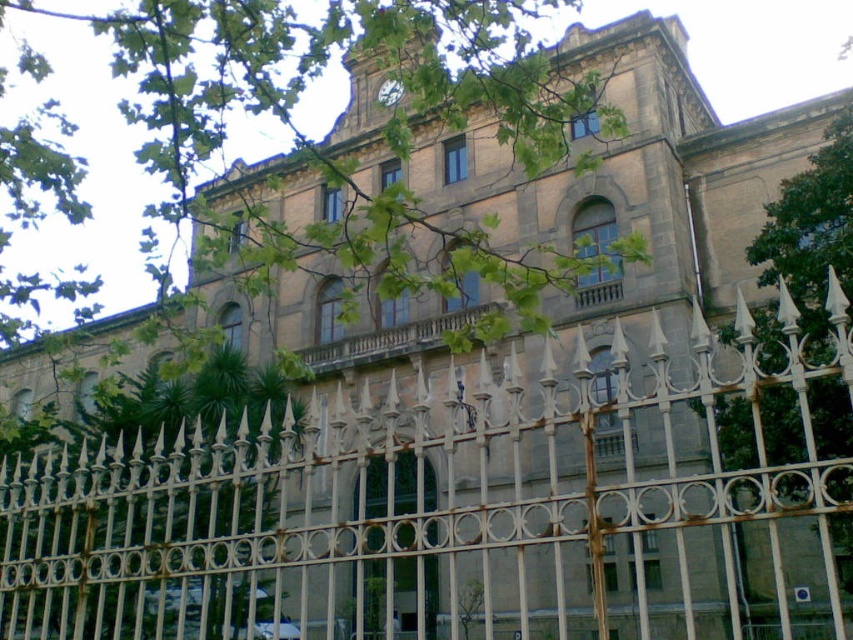
Question: Does rusty metal fence at center lie behind green leafy tree at upper left?

Choices:
 (A) no
 (B) yes

Answer: (A)

Question: Which object is closer to the camera taking this photo?

Choices:
 (A) rusty metal fence at center
 (B) green leafy tree at upper left

Answer: (A)

Question: Which is farther from the metallic silver clock at upper center?

Choices:
 (A) green leafy tree at upper left
 (B) rusty metal fence at center

Answer: (B)

Question: Estimate the real-world distances between objects in this image. Which object is closer to the metallic silver clock at upper center?

Choices:
 (A) green leafy tree at upper left
 (B) rusty metal fence at center

Answer: (A)

Question: Can you confirm if rusty metal fence at center is smaller than metallic silver clock at upper center?

Choices:
 (A) no
 (B) yes

Answer: (A)

Question: Can you confirm if green leafy tree at upper left is positioned to the right of metallic silver clock at upper center?

Choices:
 (A) no
 (B) yes

Answer: (A)